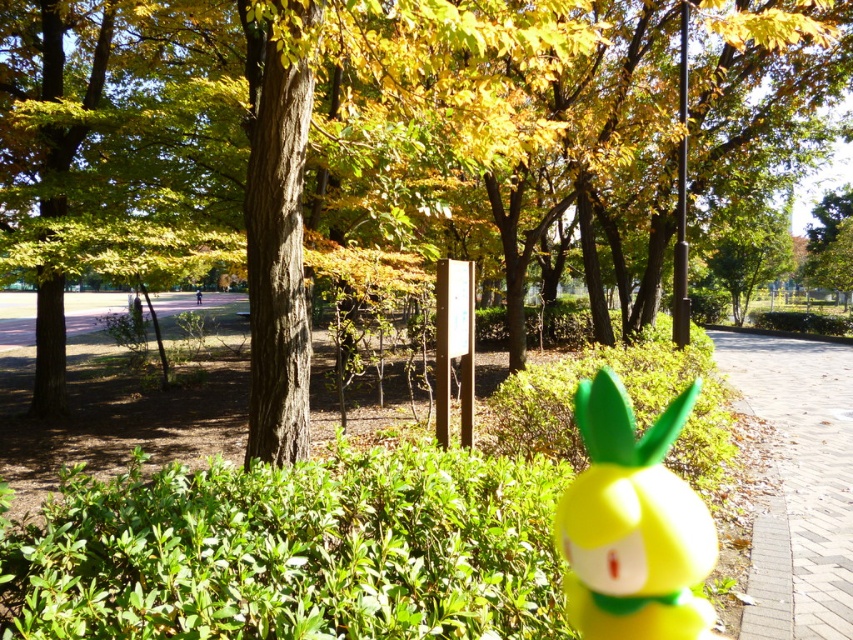
You are a photographer trying to capture both the green matte tree at center and the yellow matte toy at center in a single frame. Based on their positions, which object should you adjust your camera to focus on first to ensure both are in the frame?

The green matte tree at center is to the left of yellow matte toy at center, so you should focus on the left side first to include both objects in the frame.

From the picture: You are a photographer setting up a tripod in the park. You want to capture both the green matte tree at center and the brick paved path at lower right in your shot. Considering their heights, which object will appear taller in your photograph?

The green matte tree at center will appear taller in the photograph because it has a greater height compared to the brick paved path at lower right.